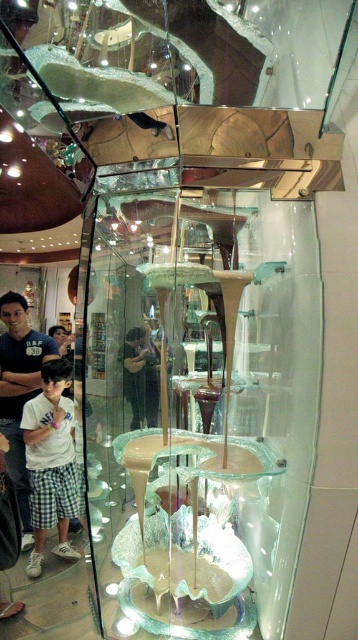
Question: Is translucent glass sculpture at center thinner than light blue shirt at center?

Choices:
 (A) yes
 (B) no

Answer: (B)

Question: Can you confirm if translucent glass sculpture at center is bigger than translucent glass bowl at center?

Choices:
 (A) no
 (B) yes

Answer: (B)

Question: Which point is closer to the camera?

Choices:
 (A) translucent glass bowl at center
 (B) translucent glass sculpture at center

Answer: (B)

Question: Which point is closer to the camera taking this photo?

Choices:
 (A) (133, 404)
 (B) (36, 560)

Answer: (B)

Question: From the image, what is the correct spatial relationship of white cotton shirt at center in relation to translucent glass bowl at center?

Choices:
 (A) left
 (B) right

Answer: (A)

Question: Which point appears farthest from the camera in this image?

Choices:
 (A) (10, 458)
 (B) (313, 328)

Answer: (A)